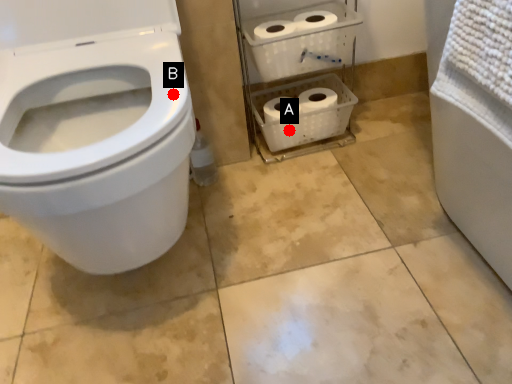
Question: Two points are circled on the image, labeled by A and B beside each circle. Which point is farther to the camera?

Choices:
 (A) A is further
 (B) B is further

Answer: (A)